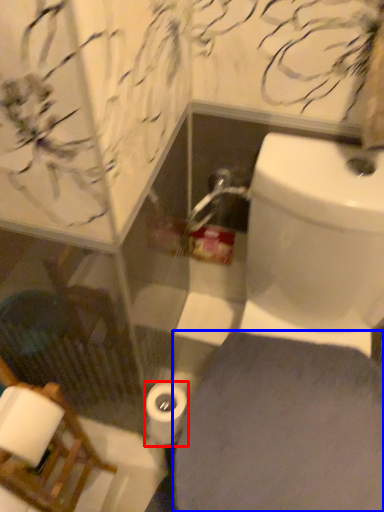
Question: Among these objects, which one is farthest to the camera, toilet paper (highlighted by a red box) or porcelain (highlighted by a blue box)?

Choices:
 (A) toilet paper
 (B) porcelain

Answer: (A)